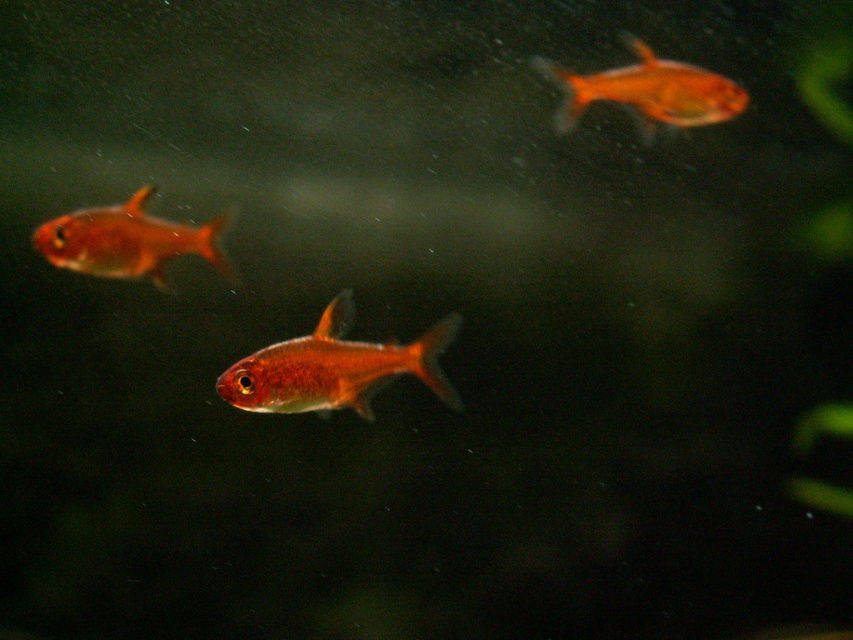
Question: Among these objects, which one is nearest to the camera?

Choices:
 (A) shiny orange fish at center
 (B) shiny orange fish at left
 (C) glossy orange fish at upper right

Answer: (A)

Question: Which point is closer to the camera taking this photo?

Choices:
 (A) (134, 205)
 (B) (576, 97)
 (C) (328, 378)

Answer: (C)

Question: From the image, what is the correct spatial relationship of shiny orange fish at center in relation to glossy orange fish at upper right?

Choices:
 (A) right
 (B) left

Answer: (B)

Question: Can you confirm if shiny orange fish at left is positioned below glossy orange fish at upper right?

Choices:
 (A) no
 (B) yes

Answer: (B)

Question: Which point appears closest to the camera in this image?

Choices:
 (A) (228, 387)
 (B) (718, 92)
 (C) (90, 236)

Answer: (A)

Question: Does shiny orange fish at center lie in front of shiny orange fish at left?

Choices:
 (A) yes
 (B) no

Answer: (A)